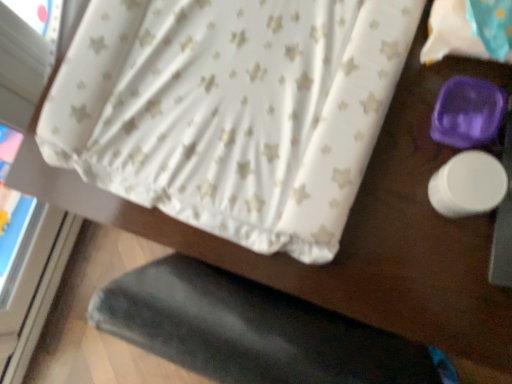
Locate an element on the screen. white star-patterned fabric at upper right is located at coordinates pyautogui.click(x=450, y=33).

The height and width of the screenshot is (384, 512). What do you see at coordinates (450, 33) in the screenshot? I see `white star-patterned fabric at upper right` at bounding box center [450, 33].

Identify the location of white star-patterned fabric at upper center. (232, 111).

Describe the element at coordinates (232, 111) in the screenshot. I see `white star-patterned fabric at upper center` at that location.

Locate an element on the screen. Image resolution: width=512 pixels, height=384 pixels. white star-patterned fabric at upper right is located at coordinates (450, 33).

Does white star-patterned fabric at upper center appear on the right side of white star-patterned fabric at upper right?

No, white star-patterned fabric at upper center is not to the right of white star-patterned fabric at upper right.

Is white star-patterned fabric at upper center in front of white star-patterned fabric at upper right?

No, it is behind white star-patterned fabric at upper right.

Is point (340, 24) positioned after point (460, 23)?

Yes.

From the image's perspective, is white star-patterned fabric at upper center positioned above or below white star-patterned fabric at upper right?

white star-patterned fabric at upper center is below white star-patterned fabric at upper right.

From a real-world perspective, is white star-patterned fabric at upper center on white star-patterned fabric at upper right?

No.

Considering the relative sizes of white star-patterned fabric at upper center and white star-patterned fabric at upper right in the image provided, is white star-patterned fabric at upper center wider than white star-patterned fabric at upper right?

Yes, white star-patterned fabric at upper center is wider than white star-patterned fabric at upper right.

Who is taller, white star-patterned fabric at upper center or white star-patterned fabric at upper right?

white star-patterned fabric at upper center is taller.

Considering the sizes of objects white star-patterned fabric at upper center and white star-patterned fabric at upper right in the image provided, who is smaller, white star-patterned fabric at upper center or white star-patterned fabric at upper right?

white star-patterned fabric at upper right is smaller.

Is white star-patterned fabric at upper right located within white star-patterned fabric at upper center?

Actually, white star-patterned fabric at upper right is outside white star-patterned fabric at upper center.

Are white star-patterned fabric at upper center and white star-patterned fabric at upper right beside each other?

No, white star-patterned fabric at upper center is not with white star-patterned fabric at upper right.

Is white star-patterned fabric at upper center turned away from white star-patterned fabric at upper right?

white star-patterned fabric at upper center is not turned away from white star-patterned fabric at upper right.

What's the angular difference between white star-patterned fabric at upper center and white star-patterned fabric at upper right's facing directions?

83.6 degrees separate the facing orientations of white star-patterned fabric at upper center and white star-patterned fabric at upper right.

The height and width of the screenshot is (384, 512). I want to click on sheet above the white star-patterned fabric at upper center (from the image's perspective), so pyautogui.click(x=450, y=33).

Which is more to the left, white star-patterned fabric at upper right or white star-patterned fabric at upper center?

Positioned to the left is white star-patterned fabric at upper center.

Between white star-patterned fabric at upper right and white star-patterned fabric at upper center, which one is positioned behind?

white star-patterned fabric at upper center is further from the camera.

Which point is more distant from viewer, [476,37] or [383,116]?

Point [383,116]

From the image's perspective, would you say white star-patterned fabric at upper right is positioned over white star-patterned fabric at upper center?

Yes.

From a real-world perspective, which is physically above, white star-patterned fabric at upper right or white star-patterned fabric at upper center?

white star-patterned fabric at upper right is physically above.

Is white star-patterned fabric at upper right wider than white star-patterned fabric at upper center?

No, white star-patterned fabric at upper right is not wider than white star-patterned fabric at upper center.

Considering the relative sizes of white star-patterned fabric at upper right and white star-patterned fabric at upper center in the image provided, is white star-patterned fabric at upper right taller than white star-patterned fabric at upper center?

No.

Who is smaller, white star-patterned fabric at upper right or white star-patterned fabric at upper center?

white star-patterned fabric at upper right is smaller.

Choose the correct answer: Is white star-patterned fabric at upper right inside white star-patterned fabric at upper center or outside it?

white star-patterned fabric at upper right is spatially situated outside white star-patterned fabric at upper center.

Are white star-patterned fabric at upper right and white star-patterned fabric at upper center located far from each other?

That's not correct — white star-patterned fabric at upper right is a little close to white star-patterned fabric at upper center.

Is white star-patterned fabric at upper right oriented towards white star-patterned fabric at upper center?

No, white star-patterned fabric at upper right does not turn towards white star-patterned fabric at upper center.

You are a GUI agent. You are given a task and a screenshot of the screen. Output one action in this format:
    pyautogui.click(x=<x>, y=<y>)
    Task: Click on the curtain that appears below the white star-patterned fabric at upper right (from the image's perspective)
    This screenshot has height=384, width=512.
    Given the screenshot: What is the action you would take?
    pyautogui.click(x=232, y=111)

Locate an element on the screen. The height and width of the screenshot is (384, 512). curtain behind the white star-patterned fabric at upper right is located at coordinates (232, 111).

You are a GUI agent. You are given a task and a screenshot of the screen. Output one action in this format:
    pyautogui.click(x=<x>, y=<y>)
    Task: Click on the sheet in front of the white star-patterned fabric at upper center
    This screenshot has width=512, height=384.
    Given the screenshot: What is the action you would take?
    (x=450, y=33)